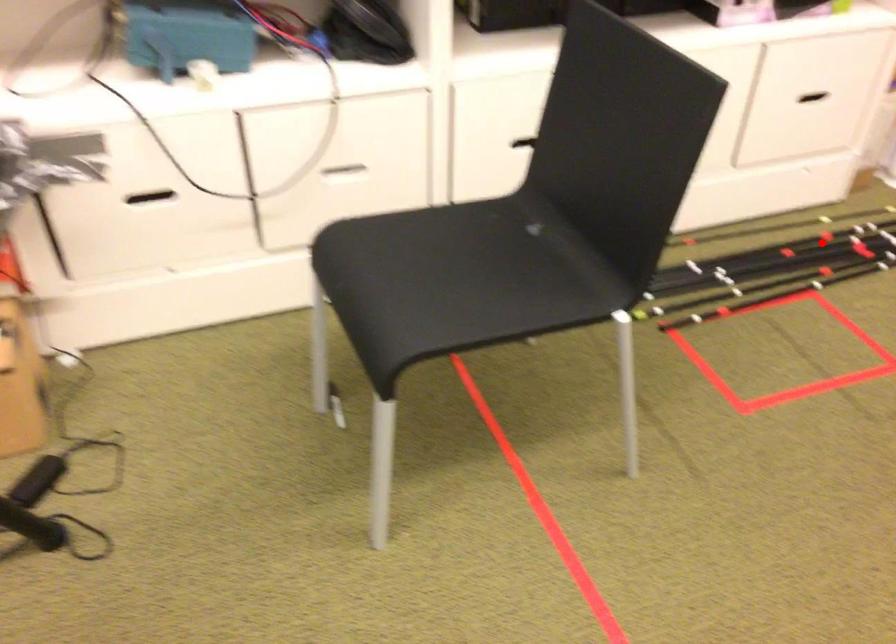
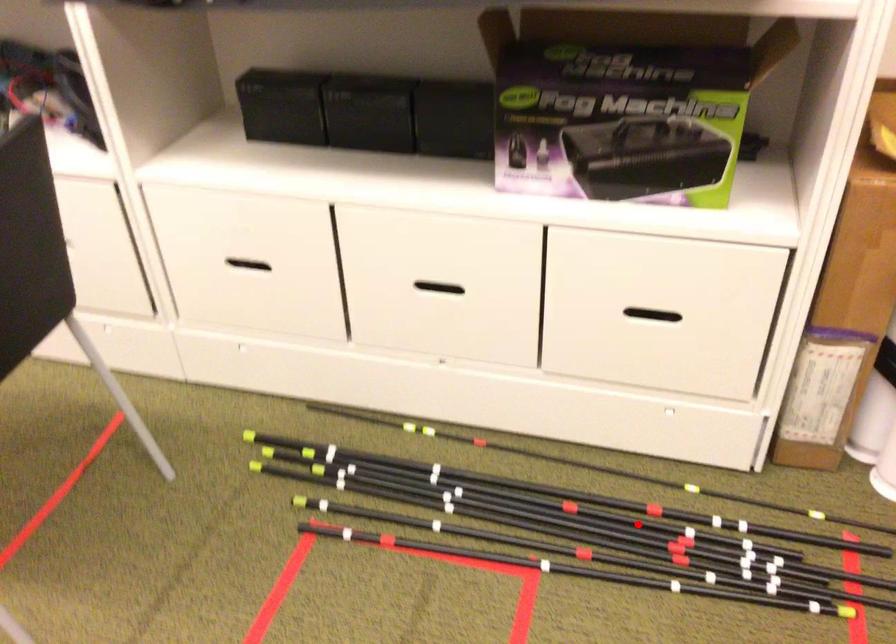
I am providing you with two images of the same scene from different viewpoints. A red point is marked on the first image and another point is marked on the second image. Are the points marked in image1 and image2 representing the same 3D position?

Yes